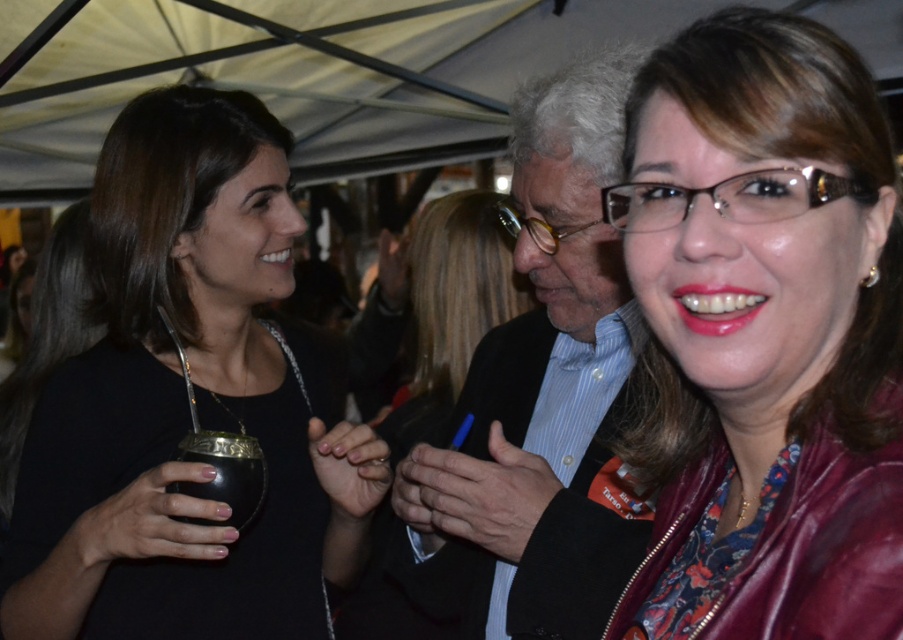
Question: Considering the real-world distances, which object is closest to the black matte mate cup at lower left?

Choices:
 (A) matte black suit at center
 (B) matte black jacket at center
 (C) black matte mate cup at left

Answer: (C)

Question: Among these points, which one is nearest to the camera?

Choices:
 (A) (114, 560)
 (B) (559, 502)
 (C) (238, 467)

Answer: (C)

Question: Which of the following is the closest to the observer?

Choices:
 (A) matte black jacket at center
 (B) black matte mate cup at lower left

Answer: (A)

Question: Does black matte mate cup at left appear over black matte mate cup at lower left?

Choices:
 (A) no
 (B) yes

Answer: (B)

Question: Does matte black jacket at center have a larger size compared to black matte mate cup at lower left?

Choices:
 (A) yes
 (B) no

Answer: (A)

Question: Does matte black suit at center have a lesser width compared to black matte mate cup at lower left?

Choices:
 (A) no
 (B) yes

Answer: (A)